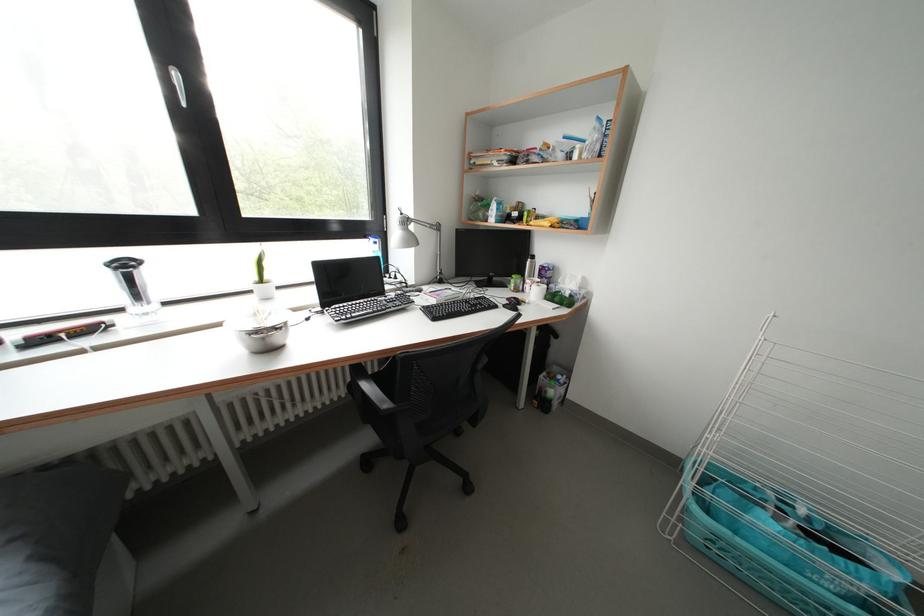
Find where to lift the blue laundry basket. Please return your answer as a coordinate pair (x, y).

(799, 538)